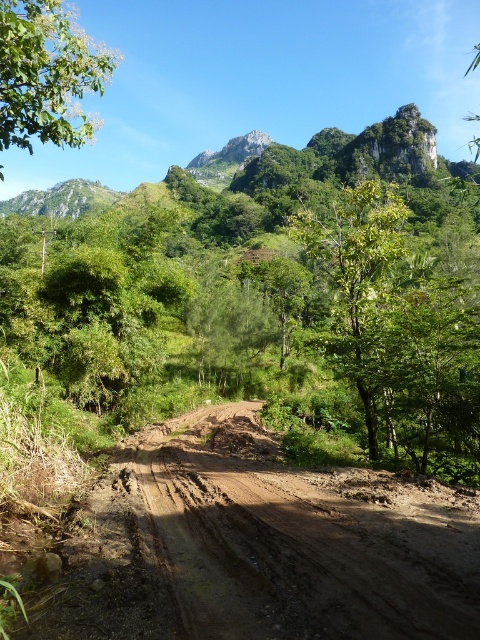
Question: Can you confirm if brown muddy dirt track at center is positioned to the left of green leafy tree at upper left?

Choices:
 (A) yes
 (B) no

Answer: (B)

Question: Can you confirm if brown muddy dirt track at center is positioned below green leafy tree at upper left?

Choices:
 (A) yes
 (B) no

Answer: (A)

Question: Estimate the real-world distances between objects in this image. Which object is farther from the brown muddy dirt track at center?

Choices:
 (A) green leafy tree at upper left
 (B) green leafy tree at center

Answer: (B)

Question: Considering the real-world distances, which object is closest to the green leafy tree at upper left?

Choices:
 (A) green leafy tree at center
 (B) brown muddy dirt track at center

Answer: (B)

Question: Which object is positioned farthest from the brown muddy dirt track at center?

Choices:
 (A) green leafy tree at upper left
 (B) green leafy tree at center

Answer: (B)

Question: Is brown muddy dirt track at center thinner than green leafy tree at upper left?

Choices:
 (A) no
 (B) yes

Answer: (B)